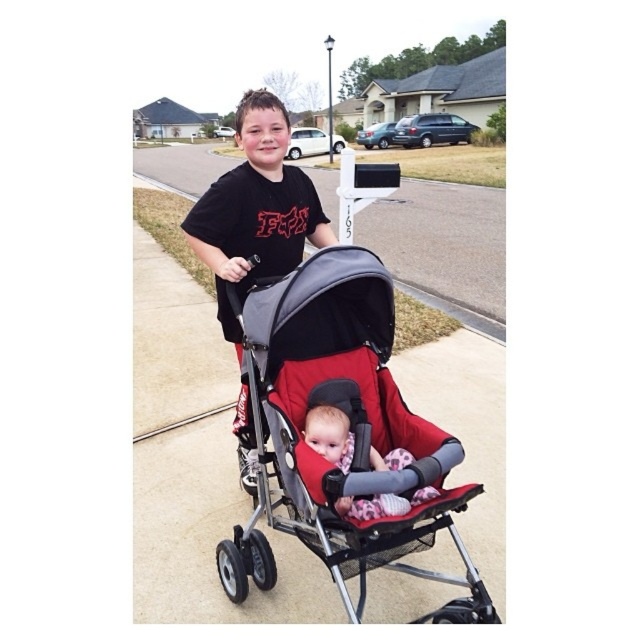
From the picture: Who is taller, red fabric stroller at center or gray fabric stroller at center?

Standing taller between the two is gray fabric stroller at center.

Where is `red fabric stroller at center`? The width and height of the screenshot is (640, 640). red fabric stroller at center is located at coordinates (349, 429).

Does gray fabric stroller at center have a larger size compared to soft pink fabric baby at center?

Yes.

Image resolution: width=640 pixels, height=640 pixels. Identify the location of gray fabric stroller at center. (442, 241).

Between point (145, 157) and point (404, 449), which one is positioned in front?

Positioned in front is point (404, 449).

You are a GUI agent. You are given a task and a screenshot of the screen. Output one action in this format:
    pyautogui.click(x=<x>, y=<y>)
    Task: Click on the gray fabric stroller at center
    This screenshot has height=640, width=640.
    Given the screenshot: What is the action you would take?
    pyautogui.click(x=442, y=241)

Find the location of a particular element. red fabric stroller at center is located at coordinates (349, 429).

Between red fabric stroller at center and soft pink fabric baby at center, which one appears on the left side from the viewer's perspective?

red fabric stroller at center

You are a GUI agent. You are given a task and a screenshot of the screen. Output one action in this format:
    pyautogui.click(x=<x>, y=<y>)
    Task: Click on the red fabric stroller at center
    This screenshot has height=640, width=640.
    Given the screenshot: What is the action you would take?
    pyautogui.click(x=349, y=429)

Find the location of a particular element. red fabric stroller at center is located at coordinates (349, 429).